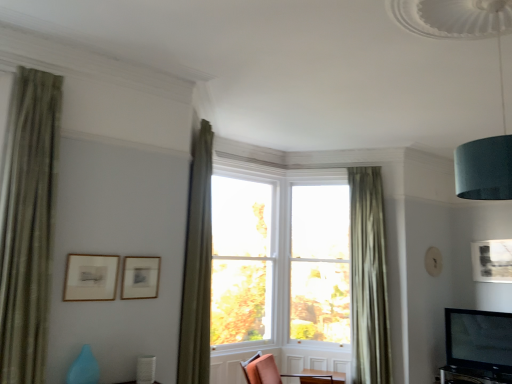
What do you see at coordinates (472, 376) in the screenshot? The width and height of the screenshot is (512, 384). I see `black glossy entertainment center at lower right` at bounding box center [472, 376].

In order to face black glossy entertainment center at lower right, should I rotate leftwards or rightwards?

Turn right by 28.342 degrees to look at black glossy entertainment center at lower right.

Measure the distance between matte orange chair at center and camera.

matte orange chair at center and camera are 13.81 feet apart from each other.

The height and width of the screenshot is (384, 512). Describe the element at coordinates (271, 371) in the screenshot. I see `matte orange chair at center` at that location.

The height and width of the screenshot is (384, 512). What do you see at coordinates (368, 278) in the screenshot? I see `green sheer curtain at right, the 1th curtain in the right-to-left sequence` at bounding box center [368, 278].

Image resolution: width=512 pixels, height=384 pixels. Describe the element at coordinates (500, 85) in the screenshot. I see `teal fabric lampshade at upper right` at that location.

Where is `matte wooden picture frame at upper left, which appears as the 3th picture frame when viewed from the back`? The image size is (512, 384). matte wooden picture frame at upper left, which appears as the 3th picture frame when viewed from the back is located at coordinates (91, 277).

Can you confirm if teal fabric lampshade at upper right is bigger than black glossy entertainment center at lower right?

Yes.

Is teal fabric lampshade at upper right facing away from black glossy entertainment center at lower right?

That's not correct — teal fabric lampshade at upper right is not looking away from black glossy entertainment center at lower right.

What are the coordinates of `lamp above the black glossy entertainment center at lower right (from the image's perspective)` in the screenshot? It's located at tap(500, 85).

Based on their positions, is teal fabric lampshade at upper right located to the left or right of black glossy entertainment center at lower right?

Based on their positions, teal fabric lampshade at upper right is located to the left of black glossy entertainment center at lower right.

The image size is (512, 384). Identify the location of chair above the black glossy entertainment center at lower right (from the image's perspective). (271, 371).

Is point (454, 382) less distant than point (304, 376)?

That is True.

Is black glossy entertainment center at lower right positioned far away from matte orange chair at center?

Indeed, black glossy entertainment center at lower right is not near matte orange chair at center.

Is black glossy entertainment center at lower right closer to the viewer compared to matte orange chair at center?

No, black glossy entertainment center at lower right is further to the viewer.

Does point (190, 272) come closer to viewer compared to point (495, 380)?

Yes, point (190, 272) is closer to viewer.

Based on the photo, does green textured curtain at upper center, which is counted as the 2th curtain, starting from the right, have a lesser width compared to black glossy entertainment center at lower right?

Correct, the width of green textured curtain at upper center, which is counted as the 2th curtain, starting from the right, is less than that of black glossy entertainment center at lower right.

Identify the location of curtain that is the 2nd one when counting upward from the black glossy entertainment center at lower right (from the image's perspective). (197, 266).

Consider the image. Considering the sizes of matte orange chair at center and clear glass window at center in the image, is matte orange chair at center wider or thinner than clear glass window at center?

In the image, matte orange chair at center appears to be wider than clear glass window at center.

Is clear glass window at center at the back of matte orange chair at center?

No, matte orange chair at center's orientation is not away from clear glass window at center.

Is matte orange chair at center bigger or smaller than clear glass window at center?

Clearly, matte orange chair at center is smaller in size than clear glass window at center.

Is matte orange chair at center spatially inside clear glass window at center, or outside of it?

matte orange chair at center lies outside clear glass window at center.

From a real-world perspective, is teal fabric lampshade at upper right above or below green sheer curtain at right, the 1th curtain in the right-to-left sequence?

teal fabric lampshade at upper right is above green sheer curtain at right, the 1th curtain in the right-to-left sequence.

Can you tell me how much teal fabric lampshade at upper right and green sheer curtain at right, which is counted as the 3th curtain, starting from the front, differ in facing direction?

36.2 degrees.

Does teal fabric lampshade at upper right have a greater width compared to green sheer curtain at right, which is the 1th curtain in back-to-front order?

Yes, teal fabric lampshade at upper right is wider than green sheer curtain at right, which is the 1th curtain in back-to-front order.

From the picture: Is teal fabric lampshade at upper right positioned with its back to green sheer curtain at right, the 1th curtain in the right-to-left sequence?

teal fabric lampshade at upper right does not have its back to green sheer curtain at right, the 1th curtain in the right-to-left sequence.

From the picture: Would you say matte gold picture frame at upper left, positioned as the second picture frame in right-to-left order, is part of teal fabric lampshade at upper right's contents?

No.

Consider the image. From a real-world perspective, is teal fabric lampshade at upper right located higher than matte gold picture frame at upper left, the 2th picture frame viewed from the left?

Yes, from a real-world perspective, teal fabric lampshade at upper right is above matte gold picture frame at upper left, the 2th picture frame viewed from the left.

Is point (471, 194) positioned in front of point (153, 292)?

Yes, point (471, 194) is closer to viewer.

From the image's perspective, is matte wooden picture frame at upper left, which appears as the 3th picture frame when viewed from the back, located above or below matte orange chair at center?

matte wooden picture frame at upper left, which appears as the 3th picture frame when viewed from the back, is above matte orange chair at center.

Which is in front, point (66, 290) or point (258, 353)?

The point (66, 290) is closer.

Is matte wooden picture frame at upper left, which appears as the 3th picture frame when viewed from the back, directly adjacent to matte orange chair at center?

matte wooden picture frame at upper left, which appears as the 3th picture frame when viewed from the back, and matte orange chair at center are not in contact.

You are a GUI agent. You are given a task and a screenshot of the screen. Output one action in this format:
    pyautogui.click(x=<x>, y=<y>)
    Task: Click on the lamp that appears above the black glossy entertainment center at lower right (from a real-world perspective)
    
    Given the screenshot: What is the action you would take?
    pyautogui.click(x=500, y=85)

Locate an element on the screen. This screenshot has height=384, width=512. chair that appears above the black glossy entertainment center at lower right (from the image's perspective) is located at coordinates (271, 371).

Considering their positions, is green textured curtain at left, marked as the 1th curtain in a front-to-back arrangement, positioned closer to matte wooden picture frame at upper left, which ranks as the 1th picture frame in left-to-right order, than green sheer curtain at right, the 1th curtain in the right-to-left sequence?

Among the two, green textured curtain at left, marked as the 1th curtain in a front-to-back arrangement, is located nearer to matte wooden picture frame at upper left, which ranks as the 1th picture frame in left-to-right order.

Which object lies further to the anchor point green sheer curtain at right, the 1th curtain in the right-to-left sequence, green textured curtain at upper center, which appears as the second curtain when viewed from the left, or clear glass window at center?

green textured curtain at upper center, which appears as the second curtain when viewed from the left, is positioned further to the anchor green sheer curtain at right, the 1th curtain in the right-to-left sequence.

When comparing their distances from matte gold picture frame at upper left, placed as the second picture frame when sorted from back to front, does black glossy tv at lower right or matte black picture frame at upper right, the first picture frame in the right-to-left sequence, seem closer?

Based on the image, black glossy tv at lower right appears to be nearer to matte gold picture frame at upper left, placed as the second picture frame when sorted from back to front.

From the image, which object appears to be nearer to green textured curtain at left, marked as the third curtain in a right-to-left arrangement, teal fabric lampshade at upper right or clear glass window at center?

teal fabric lampshade at upper right is positioned closer to the anchor green textured curtain at left, marked as the third curtain in a right-to-left arrangement.

Looking at the image, which one is located closer to green textured curtain at left, which is the 1th curtain from left to right, green textured curtain at upper center, acting as the 2th curtain starting from the back, or clear glass window at center?

Based on the image, green textured curtain at upper center, acting as the 2th curtain starting from the back, appears to be nearer to green textured curtain at left, which is the 1th curtain from left to right.

Which object lies nearer to the anchor point matte gold picture frame at upper left, positioned as the second picture frame in right-to-left order, matte orange chair at center or green textured curtain at upper center, which appears as the 2th curtain when viewed from the front?

green textured curtain at upper center, which appears as the 2th curtain when viewed from the front, lies closer to matte gold picture frame at upper left, positioned as the second picture frame in right-to-left order, than the other object.

From the image, which object appears to be farther from black glossy entertainment center at lower right, clear glass window at center or teal fabric lampshade at upper right?

The object further to black glossy entertainment center at lower right is teal fabric lampshade at upper right.

From the image, which object appears to be farther from green textured curtain at upper center, which appears as the 2th curtain when viewed from the front, clear glass window at center or matte gold picture frame at upper left, positioned as the second picture frame in right-to-left order?

clear glass window at center is further to green textured curtain at upper center, which appears as the 2th curtain when viewed from the front.

Locate an element on the screen. Image resolution: width=512 pixels, height=384 pixels. television between green textured curtain at left, which is the 3th curtain from back to front, and matte black picture frame at upper right, which is counted as the 3th picture frame, starting from the front, from left to right is located at coordinates (477, 347).

This screenshot has height=384, width=512. In order to click on picture frame between matte wooden picture frame at upper left, which is the third picture frame in right-to-left order, and clear glass window at center from front to back in this screenshot , I will do `click(140, 277)`.

This screenshot has height=384, width=512. What are the coordinates of `window frame between clear glass window at center and black glossy entertainment center at lower right` in the screenshot? It's located at click(320, 264).

Find the location of `television situated between green textured curtain at left, which is the 3th curtain from back to front, and black glossy entertainment center at lower right from left to right`. television situated between green textured curtain at left, which is the 3th curtain from back to front, and black glossy entertainment center at lower right from left to right is located at coordinates (477, 347).